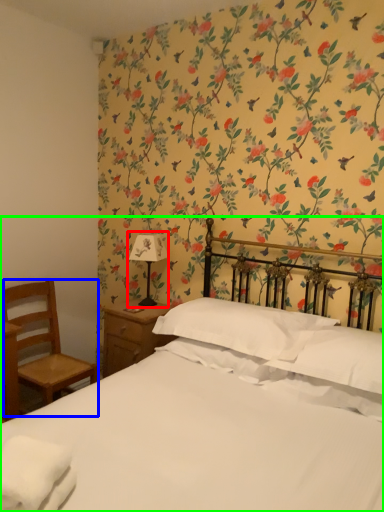
Question: Based on their relative distances, which object is farther from bedside lamp (highlighted by a red box)? Choose from chair (highlighted by a blue box) and bed (highlighted by a green box).

Choices:
 (A) chair
 (B) bed

Answer: (B)